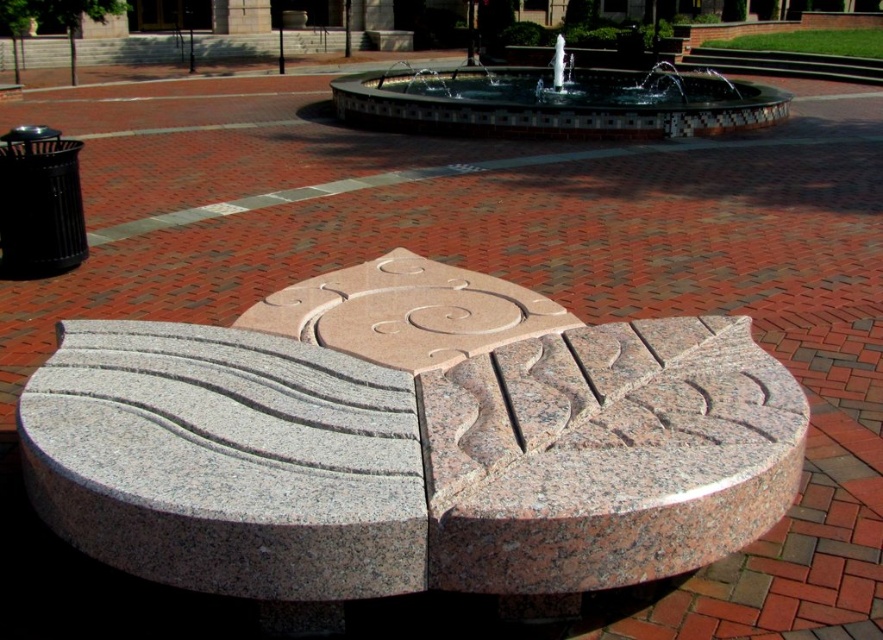
Who is more forward, (111, 481) or (710, 109)?

Point (111, 481) is more forward.

At what (x,y) coordinates should I click in order to perform the action: click on granite sculpture at center. Please return your answer as a coordinate pair (x, y). Looking at the image, I should click on coord(409,442).

Find the location of `granite sculpture at center`. granite sculpture at center is located at coordinates (409, 442).